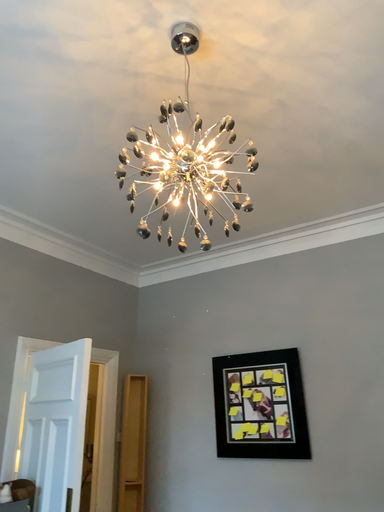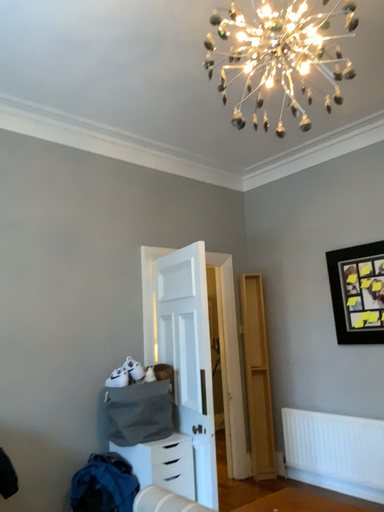
Question: Which way did the camera rotate in the video?

Choices:
 (A) rotated downward
 (B) rotated upward

Answer: (A)